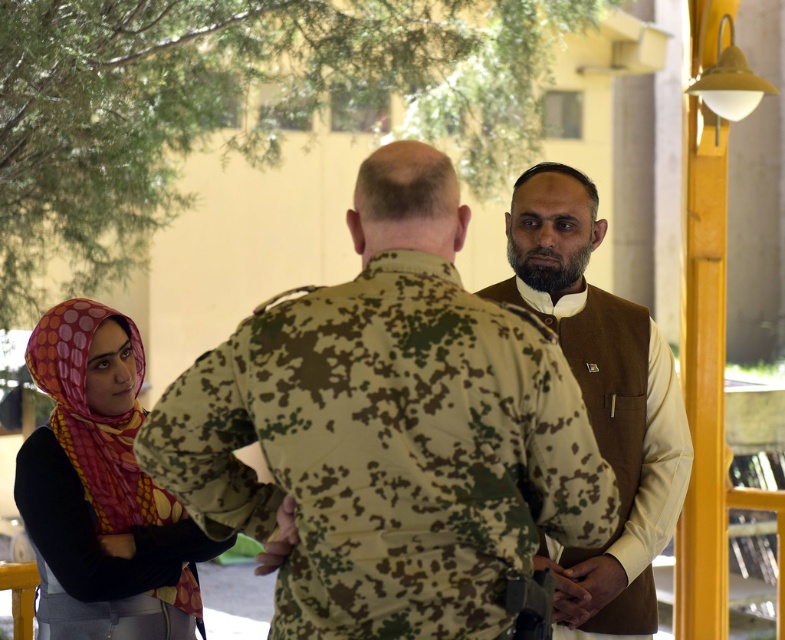
You are a photographer trying to capture a group photo of the polka dot fabric hijab at lower left and the brown textured vest at center. Which object should you focus on first if you want to include both in the frame without moving the camera?

The polka dot fabric hijab at lower left is shorter than the brown textured vest at center, so you should focus on the brown textured vest at center first to ensure both are in frame.

You are a photographer trying to capture a group photo of the camouflage uniform at center and the polka dot fabric hijab at lower left. Given that your camera has a maximum focus range of 3 feet, will you be able to include both subjects in the same frame without moving either of them?

The distance between the camouflage uniform at center and the polka dot fabric hijab at lower left is 3.53 feet, which exceeds the camera maximum focus range of 3 feet. Therefore, you cannot include both subjects in the same frame without moving them.

You are a photographer trying to capture a group photo of the camouflage uniform at center and the brown textured vest at center. If you want to ensure both are fully visible in the frame, which person should you position closer to the camera?

The camouflage uniform at center should be positioned closer to the camera because its width surpasses that of the brown textured vest at center, ensuring it fits better within the frame.